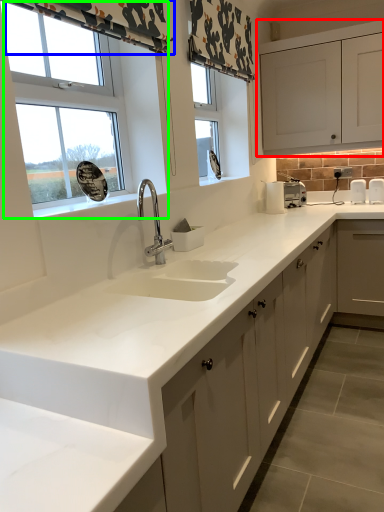
Question: Which object is positioned closest to cabinetry (highlighted by a red box)? Select from curtain (highlighted by a blue box) and window (highlighted by a green box).

Choices:
 (A) curtain
 (B) window

Answer: (A)